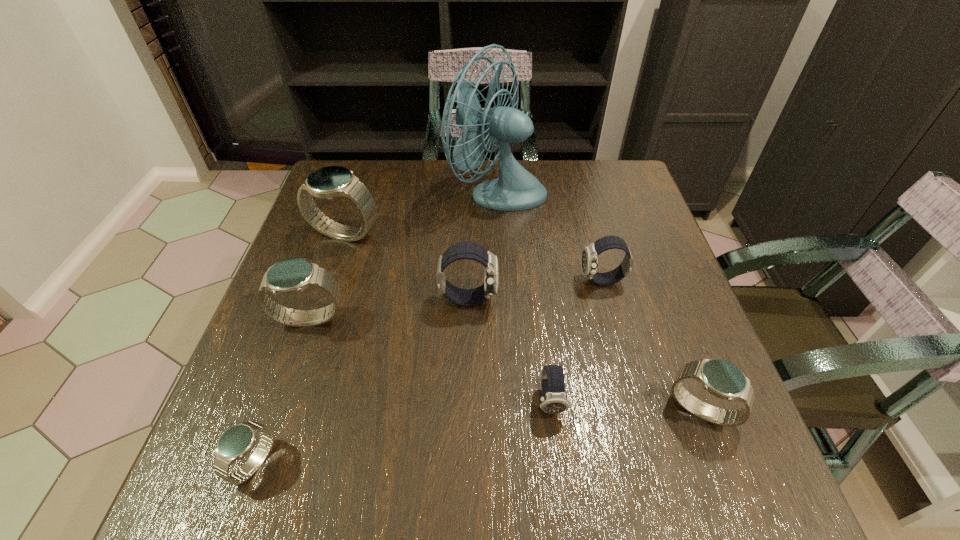
Locate which dark watch is the second closest to the nearest dark watch. Please provide its 2D coordinates. Your answer should be formatted as a tuple, i.e. [(x, y)], where the tuple contains the x and y coordinates of a point satisfying the conditions above.

[(590, 255)]

The width and height of the screenshot is (960, 540). Find the location of `free space that satisfies the following two spatial constraints: 1. on the face of the fourth watch from left to right; 2. on the left side of the third biggest blue watch`. free space that satisfies the following two spatial constraints: 1. on the face of the fourth watch from left to right; 2. on the left side of the third biggest blue watch is located at coordinates click(466, 410).

Locate an element on the screen. vacant space that satisfies the following two spatial constraints: 1. on the back side of the third nearest blue watch; 2. on the left side of the smallest blue watch is located at coordinates (305, 320).